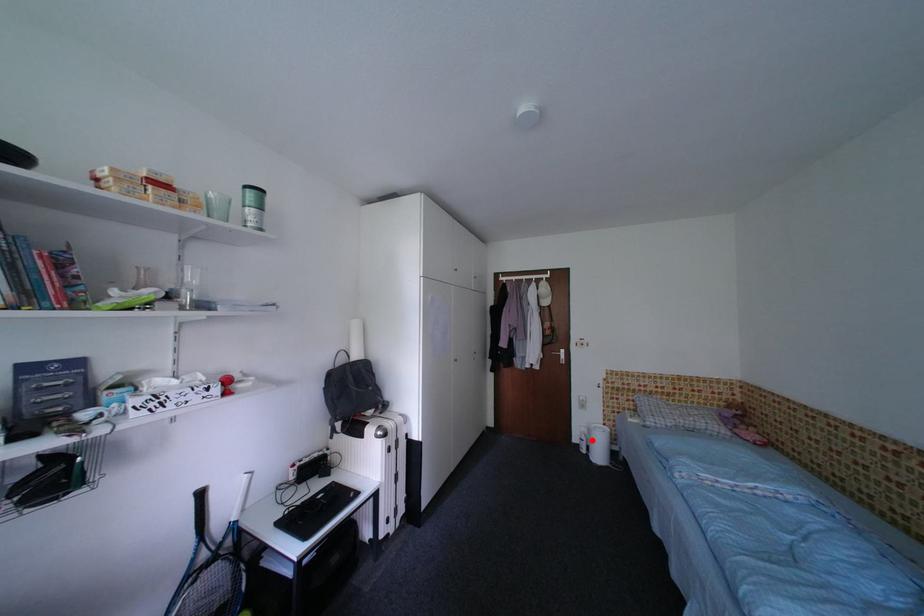
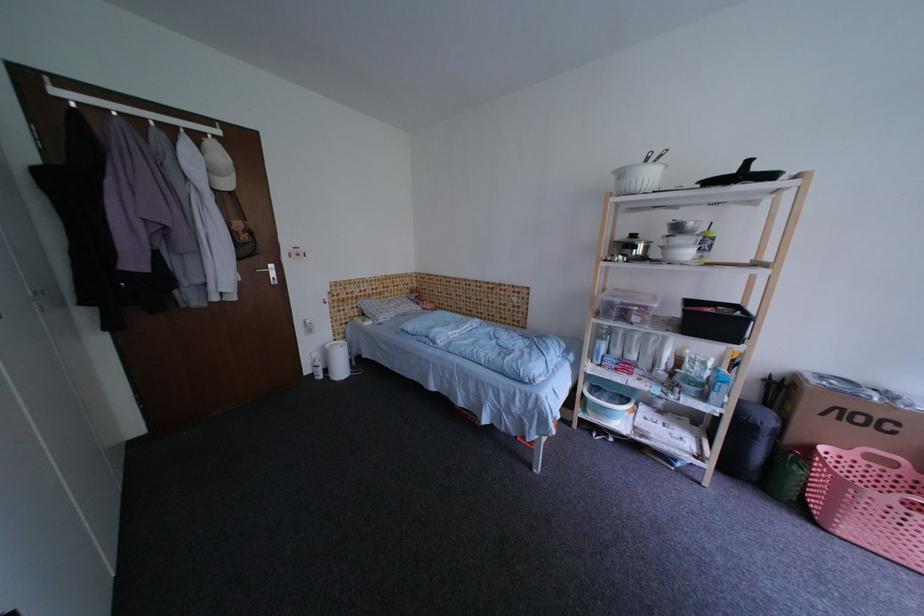
In the second image, find the point that corresponds to the highlighted location in the first image.

(326, 366)